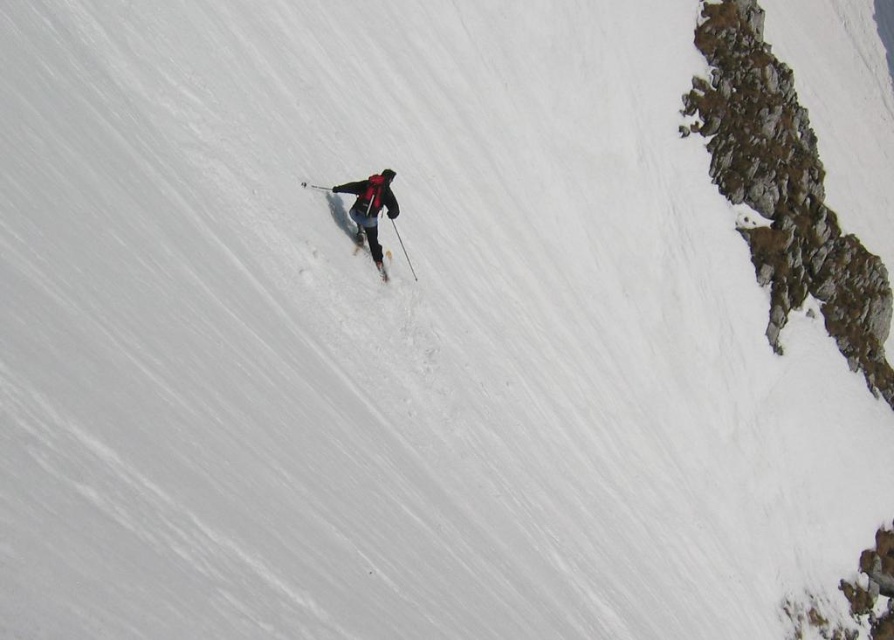
You are a photographer trying to capture the skier in the scene. You want to ensure both the matte black ski suit at center and the matte black ski at center are clearly visible in your photo. Given their sizes, which object should you focus on to ensure both are in frame?

The matte black ski suit at center is larger in size than the matte black ski at center, so focusing on the matte black ski suit at center will ensure both are in frame as the larger object will dominate the composition while the smaller ski remains visible.

You are a photographer trying to capture a closeup shot of the skier. Your camera can focus on objects within a 15 inch radius. Will both the matte black ski suit at center and the matte black ski at center be in focus?

The matte black ski suit at center and matte black ski at center are 17.24 inches apart, which exceeds the 15 inch focus range. Therefore, both cannot be in focus simultaneously.